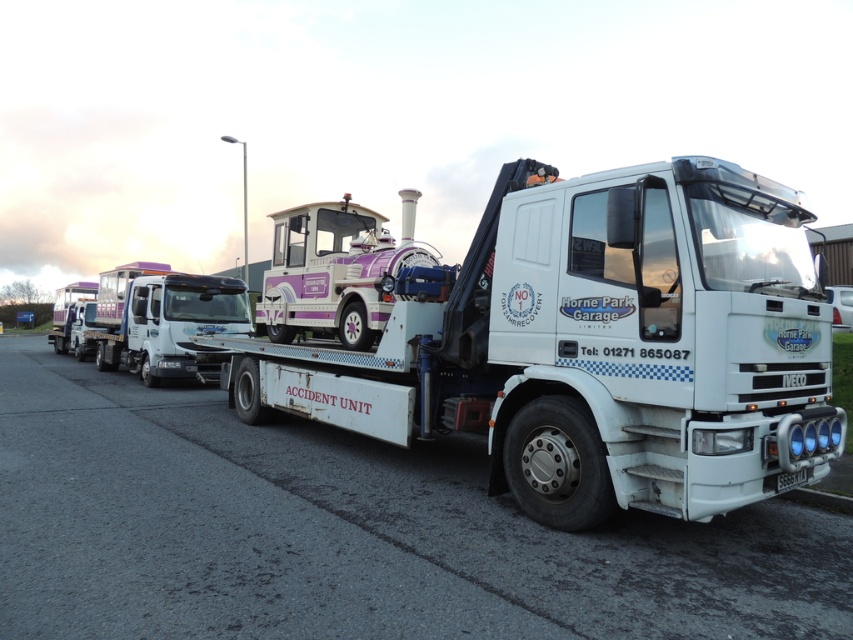
Question: Which of these objects is positioned closest to the white metallic trailer truck at center?

Choices:
 (A) white glossy truck at center
 (B) purple glossy steam engine at center

Answer: (B)

Question: Which object is positioned closest to the white metallic trailer truck at center?

Choices:
 (A) black plastic license plate at center
 (B) purple glossy steam engine at center
 (C) white glossy truck at center

Answer: (A)

Question: Does white metallic trailer truck at center have a smaller size compared to black plastic license plate at center?

Choices:
 (A) no
 (B) yes

Answer: (A)

Question: Estimate the real-world distances between objects in this image. Which object is farther from the black plastic license plate at center?

Choices:
 (A) white glossy truck at center
 (B) white metallic trailer truck at center

Answer: (A)

Question: Considering the relative positions of white glossy truck at center and black plastic license plate at center in the image provided, where is white glossy truck at center located with respect to black plastic license plate at center?

Choices:
 (A) right
 (B) left

Answer: (B)

Question: Does white metallic trailer truck at center lie in front of purple glossy steam engine at center?

Choices:
 (A) no
 (B) yes

Answer: (B)